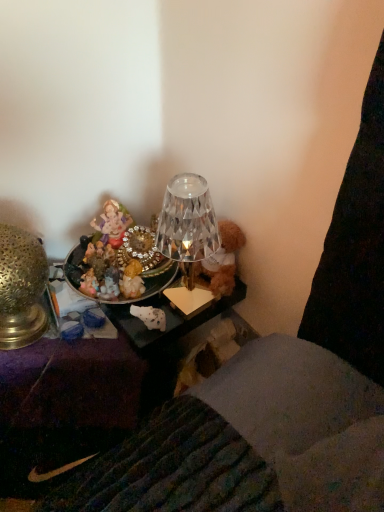
Question: From the image's perspective, is porcelain figurine at upper center on gold textured lamp at left?

Choices:
 (A) yes
 (B) no

Answer: (A)

Question: Considering the relative sizes of porcelain figurine at upper center and gold textured lamp at left in the image provided, is porcelain figurine at upper center bigger than gold textured lamp at left?

Choices:
 (A) no
 (B) yes

Answer: (A)

Question: Considering the relative sizes of porcelain figurine at upper center and gold textured lamp at left in the image provided, is porcelain figurine at upper center smaller than gold textured lamp at left?

Choices:
 (A) no
 (B) yes

Answer: (B)

Question: Can you confirm if porcelain figurine at upper center is positioned to the left of gold textured lamp at left?

Choices:
 (A) yes
 (B) no

Answer: (B)

Question: Does porcelain figurine at upper center lie behind gold textured lamp at left?

Choices:
 (A) no
 (B) yes

Answer: (B)

Question: Is metallic/mesh tray at left bigger or smaller than gold textured lamp at left?

Choices:
 (A) big
 (B) small

Answer: (A)

Question: Is metallic/mesh tray at left taller or shorter than gold textured lamp at left?

Choices:
 (A) tall
 (B) short

Answer: (A)

Question: Considering the positions of metallic/mesh tray at left and gold textured lamp at left in the image, is metallic/mesh tray at left wider or thinner than gold textured lamp at left?

Choices:
 (A) wide
 (B) thin

Answer: (A)

Question: Would you say metallic/mesh tray at left is inside or outside gold textured lamp at left?

Choices:
 (A) inside
 (B) outside

Answer: (B)

Question: Is gold textured lamp at left taller or shorter than porcelain figurine at upper center?

Choices:
 (A) tall
 (B) short

Answer: (A)

Question: In the image, is gold textured lamp at left on the left side or the right side of porcelain figurine at upper center?

Choices:
 (A) right
 (B) left

Answer: (B)

Question: In terms of width, does gold textured lamp at left look wider or thinner when compared to porcelain figurine at upper center?

Choices:
 (A) wide
 (B) thin

Answer: (A)

Question: From a real-world perspective, relative to porcelain figurine at upper center, is gold textured lamp at left vertically above or below?

Choices:
 (A) above
 (B) below

Answer: (B)

Question: Considering the positions of point tap(19, 271) and point tap(87, 395), is point tap(19, 271) closer or farther from the camera than point tap(87, 395)?

Choices:
 (A) closer
 (B) farther

Answer: (A)

Question: Is gold textured lamp at left taller or shorter than metallic/mesh tray at left?

Choices:
 (A) short
 (B) tall

Answer: (A)